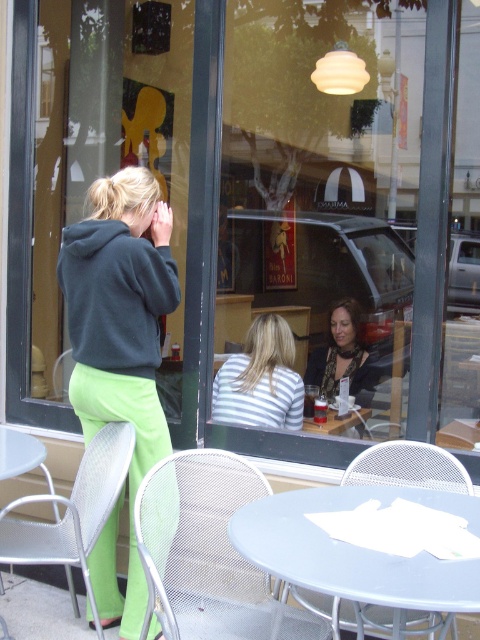
Question: Which object is the closest to the metal mesh chair at lower center?

Choices:
 (A) floral-patterned blouse at center
 (B) metal mesh chair at lower left
 (C) light blue plastic table at center
 (D) smooth gray table at center

Answer: (C)

Question: Which object is closer to the camera taking this photo?

Choices:
 (A) green fabric pants at lower left
 (B) smooth gray table at center
 (C) light blue plastic table at center
 (D) striped fabric shirt at center

Answer: (C)

Question: Can you confirm if striped fabric shirt at center is positioned to the left of smooth gray table at center?

Choices:
 (A) no
 (B) yes

Answer: (B)

Question: Is metal mesh chair at lower center in front of striped fabric shirt at center?

Choices:
 (A) yes
 (B) no

Answer: (A)

Question: Does metal mesh chair at lower center have a greater width compared to light blue plastic table at center?

Choices:
 (A) no
 (B) yes

Answer: (A)

Question: Among these points, which one is farthest from the camera?

Choices:
 (A) (257, 522)
 (B) (100, 396)
 (C) (220, 596)

Answer: (B)